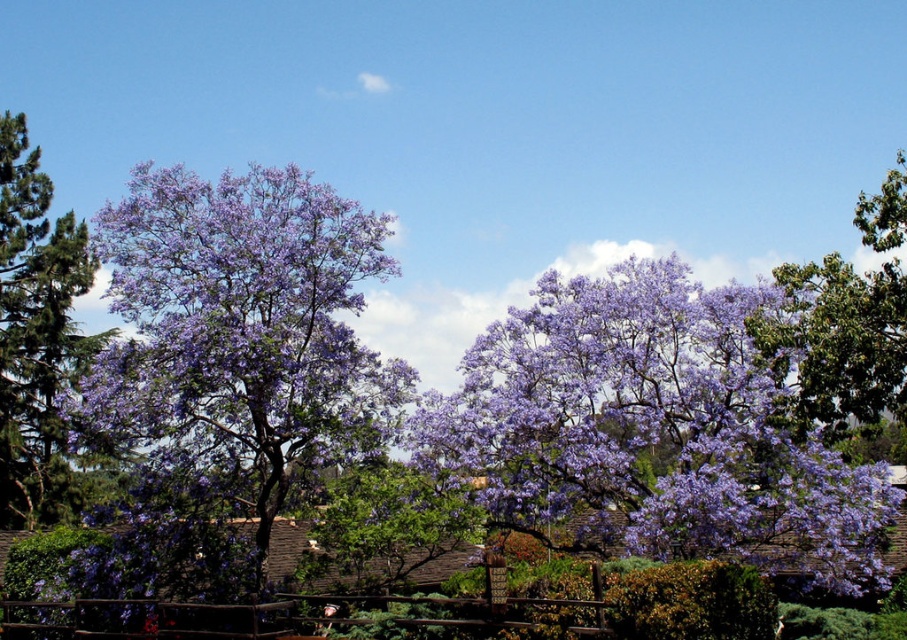
You are standing in front of the blooming trees and notice two points marked in the scene. The first point is at coordinates point (503, 337) and the second is at point (816, 355). Which point is closer to you?

Point (503, 337) is further to the camera than point (816, 355), so the second point is closer to you.

You are an artist planning to paint the scene. You want to ensure the purple matte flowers at center and the purple leafy tree at upper right are proportionally accurate. Which object should you paint smaller in your artwork?

The purple matte flowers at center should be painted smaller because they have a lesser width compared to the purple leafy tree at upper right.